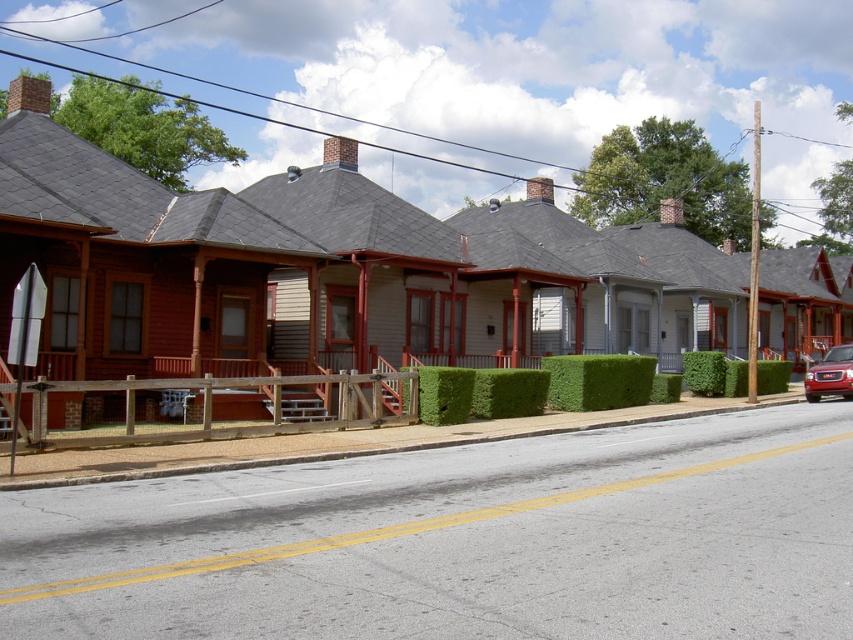
The height and width of the screenshot is (640, 853). What are the coordinates of `green hedge at center` in the screenshot? It's located at (321, 268).

Does green hedge at center have a smaller size compared to shiny red suv at right?

Incorrect, green hedge at center is not smaller in size than shiny red suv at right.

The height and width of the screenshot is (640, 853). I want to click on green hedge at center, so click(x=321, y=268).

Does brown wooden fence at center have a greater width compared to shiny red suv at right?

No.

Who is shorter, brown wooden fence at center or shiny red suv at right?

brown wooden fence at center is shorter.

Which is in front, point (334, 384) or point (846, 394)?

Positioned in front is point (334, 384).

This screenshot has width=853, height=640. In order to click on brown wooden fence at center in this screenshot , I will do `click(231, 424)`.

Which is behind, point (84, 385) or point (630, 381)?

Positioned behind is point (630, 381).

Between point (164, 435) and point (572, 404), which one is positioned in front?

Positioned in front is point (164, 435).

The image size is (853, 640). What are the coordinates of `brown wooden fence at center` in the screenshot? It's located at (231, 424).